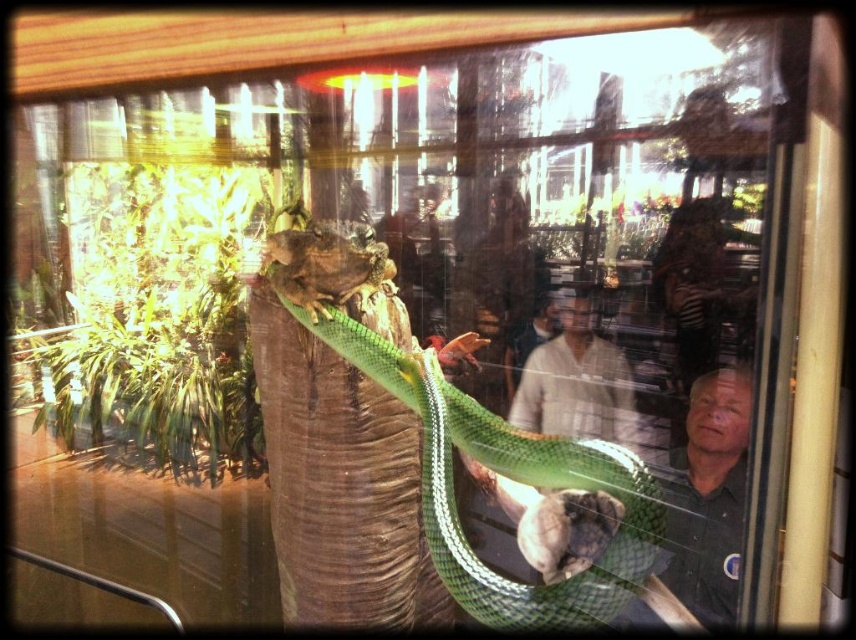
Question: Which object appears farthest from the camera in this image?

Choices:
 (A) dark green shirt at right
 (B) matte white shirt at center

Answer: (B)

Question: Does dark green shirt at right appear on the right side of green scaly lizard at center?

Choices:
 (A) yes
 (B) no

Answer: (A)

Question: Considering the real-world distances, which object is closest to the dark green shirt at right?

Choices:
 (A) matte white shirt at center
 (B) green scaly lizard at center

Answer: (A)

Question: Which point appears closest to the camera in this image?

Choices:
 (A) (510, 483)
 (B) (360, 307)
 (C) (708, 604)

Answer: (A)

Question: Can you confirm if dark green shirt at right is thinner than green scaly lizard at center?

Choices:
 (A) yes
 (B) no

Answer: (B)

Question: In this image, where is green glossy snake at center located relative to matte white shirt at center?

Choices:
 (A) left
 (B) right

Answer: (A)